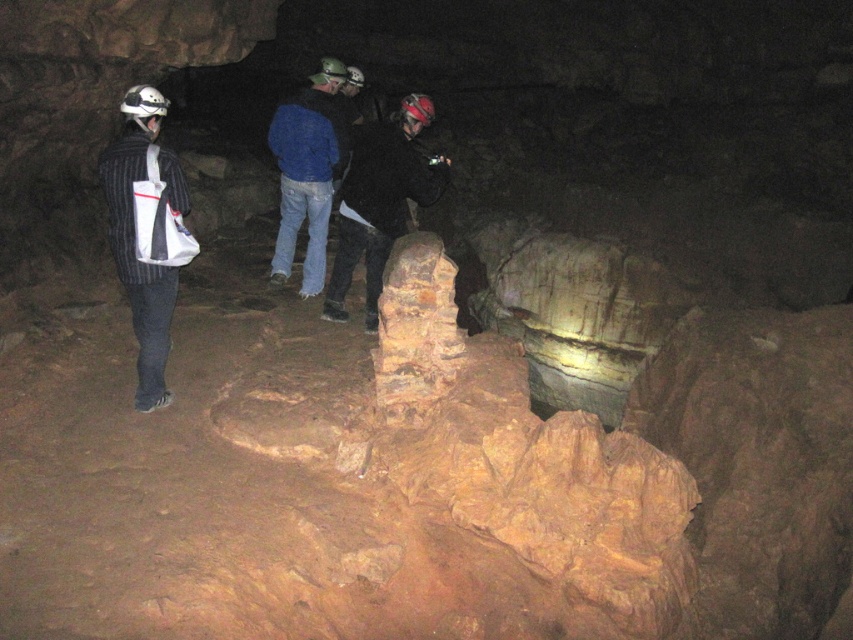
What do you see at coordinates (148, 232) in the screenshot? The height and width of the screenshot is (640, 853). I see `striped fabric backpack at left` at bounding box center [148, 232].

Can you confirm if striped fabric backpack at left is smaller than blue denim jeans at center?

Yes.

Who is more forward, (137, 182) or (331, 182)?

Point (137, 182)

Locate an element on the screen. This screenshot has width=853, height=640. striped fabric backpack at left is located at coordinates (148, 232).

Who is shorter, striped fabric backpack at left or dark matte jacket at center?

dark matte jacket at center

Between striped fabric backpack at left and dark matte jacket at center, which one appears on the left side from the viewer's perspective?

striped fabric backpack at left

Describe the element at coordinates (148, 232) in the screenshot. This screenshot has height=640, width=853. I see `striped fabric backpack at left` at that location.

Identify the location of striped fabric backpack at left. This screenshot has width=853, height=640. (148, 232).

Which is more to the right, dark matte jacket at center or blue denim jeans at center?

Positioned to the right is dark matte jacket at center.

Which is in front, point (370, 132) or point (312, 76)?

Point (370, 132) is in front.

Locate an element on the screen. This screenshot has width=853, height=640. dark matte jacket at center is located at coordinates (380, 202).